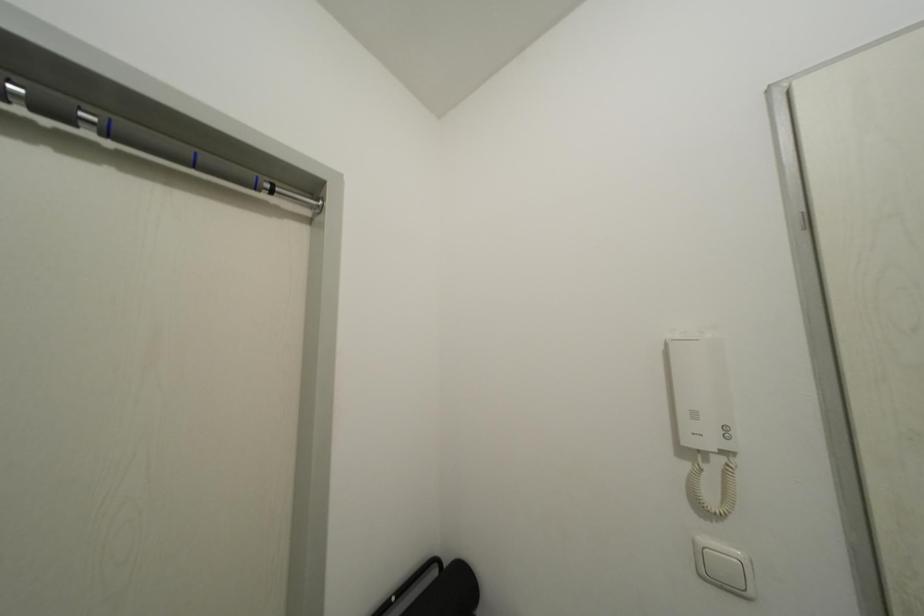
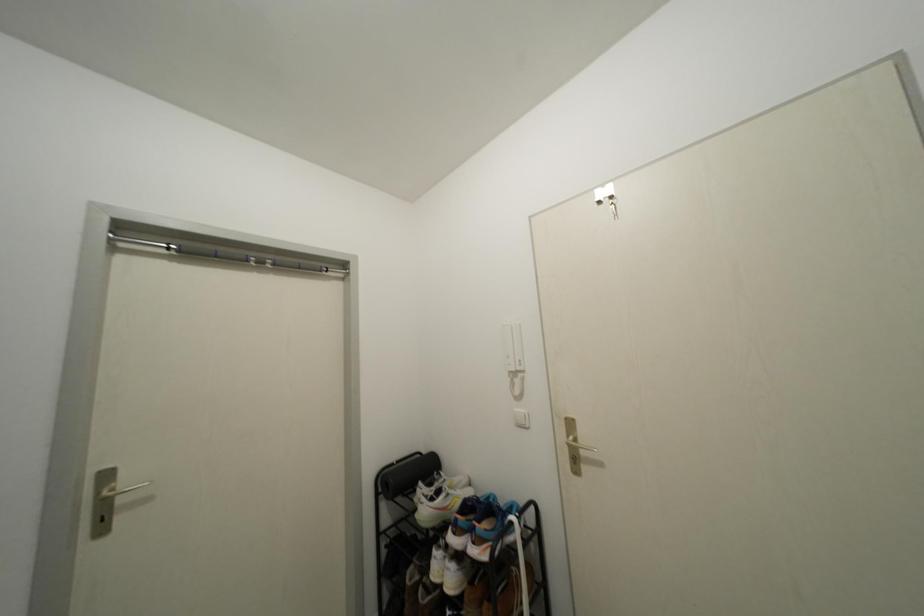
What movement of the cameraman would produce the second image?

The cameraman moved toward right, backward.